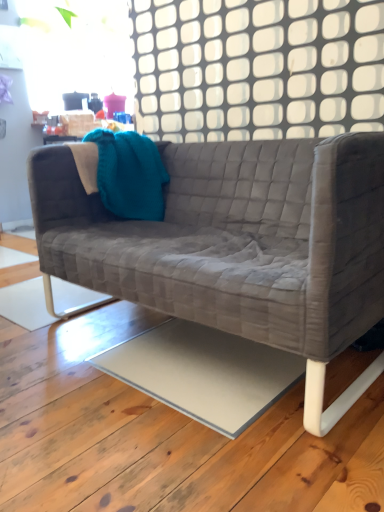
Question: Considering the positions of point (364, 148) and point (117, 170), is point (364, 148) closer or farther from the camera than point (117, 170)?

Choices:
 (A) farther
 (B) closer

Answer: (B)

Question: From their relative heights in the image, would you say velvet grey couch at center is taller or shorter than teal knitted throw pillow at upper left?

Choices:
 (A) short
 (B) tall

Answer: (B)

Question: Which object is the farthest from the teal knitted throw pillow at upper left?

Choices:
 (A) velvet grey couch at center
 (B) white grid at upper center

Answer: (B)

Question: Estimate the real-world distances between objects in this image. Which object is farther from the white grid at upper center?

Choices:
 (A) teal knitted throw pillow at upper left
 (B) velvet grey couch at center

Answer: (B)